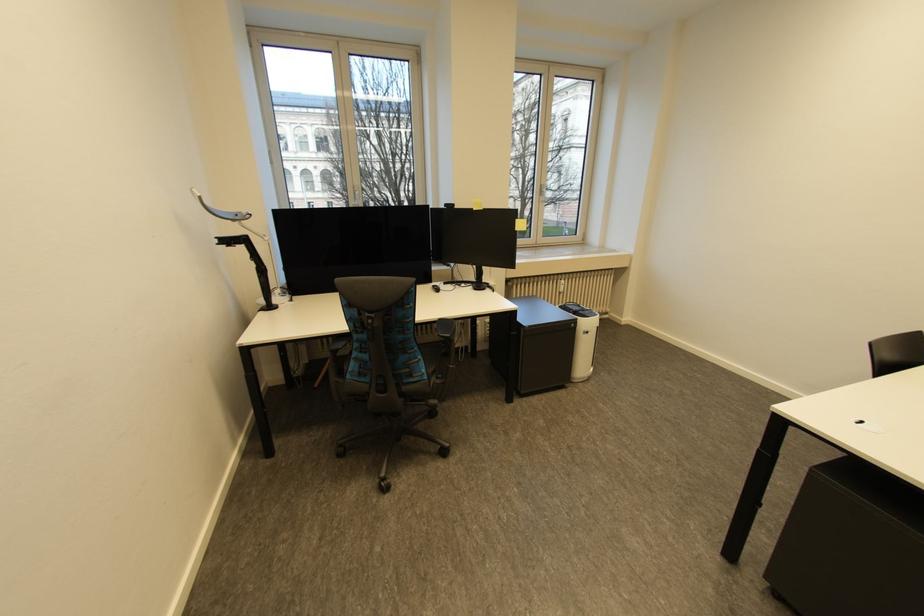
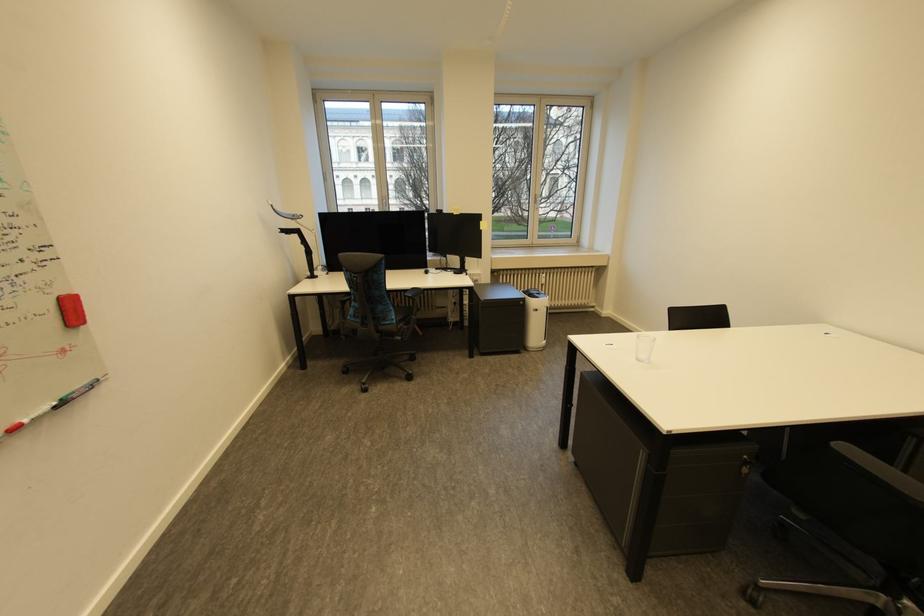
Find the pixel in the second image that matches [594,333] in the first image.

(543, 310)